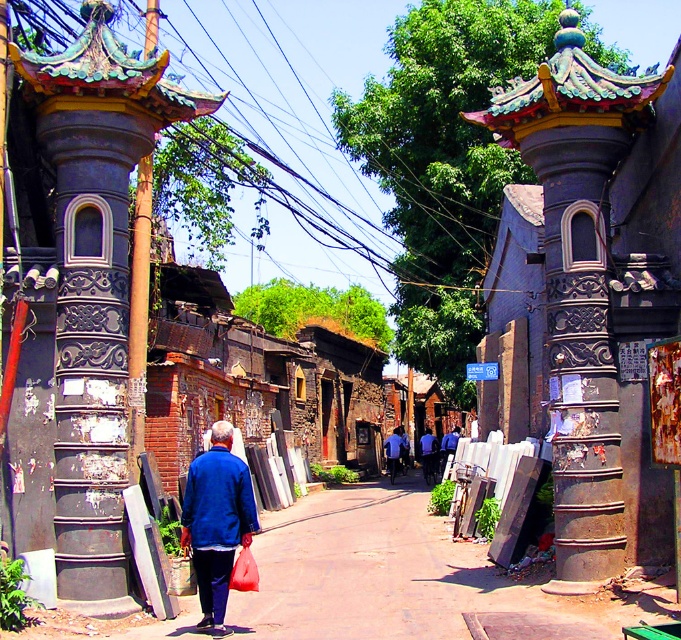
Question: Which object appears closest to the camera in this image?

Choices:
 (A) blue matte jacket at center
 (B) brushed metal power line at upper center

Answer: (A)

Question: Which of the following is the farthest from the observer?

Choices:
 (A) blue matte jacket at lower left
 (B) blue matte jacket at center
 (C) blue fabric jacket at center

Answer: (C)

Question: Among these objects, which one is nearest to the camera?

Choices:
 (A) blue fabric jacket at center
 (B) blue matte jacket at lower left

Answer: (B)

Question: Does blue matte jacket at center have a smaller size compared to blue fabric jacket at center?

Choices:
 (A) yes
 (B) no

Answer: (A)

Question: Can you confirm if brushed metal power line at upper center is positioned above blue fabric shirt at center?

Choices:
 (A) yes
 (B) no

Answer: (A)

Question: Is blue matte jacket at center to the left of blue fabric jacket at center from the viewer's perspective?

Choices:
 (A) yes
 (B) no

Answer: (A)